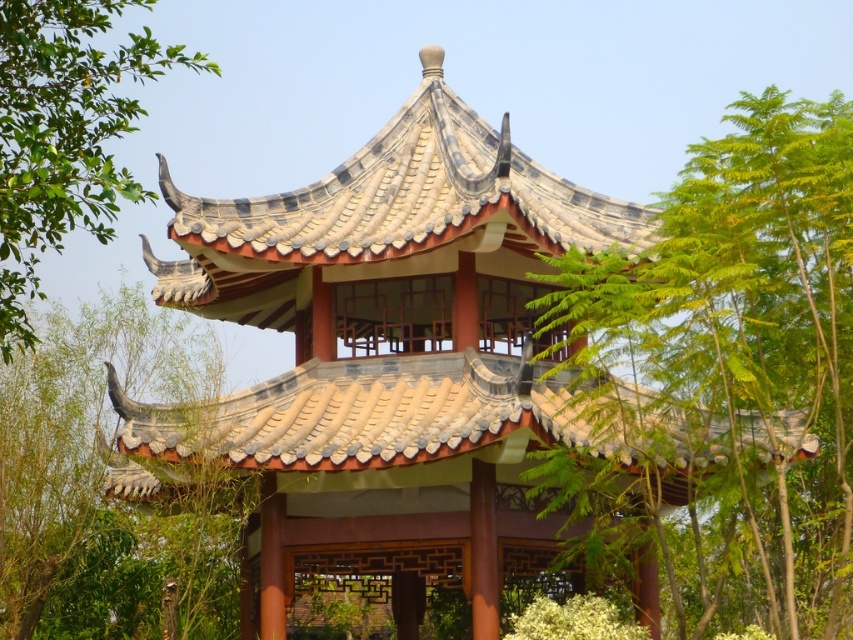
Which of these two, green leafy tree at center or green leafy tree at upper left, stands taller?

With more height is green leafy tree at upper left.

Is green leafy tree at center to the right of green leafy tree at upper left from the viewer's perspective?

Indeed, green leafy tree at center is positioned on the right side of green leafy tree at upper left.

Which is behind, point (787, 326) or point (97, 182)?

Positioned behind is point (787, 326).

This screenshot has height=640, width=853. I want to click on green leafy tree at center, so click(723, 378).

Is brown textured roof at upper center positioned in front of green leafy tree at upper left?

No, brown textured roof at upper center is further to the viewer.

Is brown textured roof at upper center to the left of green leafy tree at upper left from the viewer's perspective?

Incorrect, brown textured roof at upper center is not on the left side of green leafy tree at upper left.

Is point (228, 612) positioned in front of point (73, 22)?

No, it is not.

You are a GUI agent. You are given a task and a screenshot of the screen. Output one action in this format:
    pyautogui.click(x=<x>, y=<y>)
    Task: Click on the brown textured roof at upper center
    The image size is (853, 640).
    Given the screenshot: What is the action you would take?
    pyautogui.click(x=103, y=481)

Does green leafy tree at center appear on the right side of brown textured roof at upper center?

Indeed, green leafy tree at center is positioned on the right side of brown textured roof at upper center.

Which is above, green leafy tree at center or brown textured roof at upper center?

brown textured roof at upper center

Is point (782, 433) farther from camera compared to point (234, 540)?

No, (782, 433) is closer to viewer.

I want to click on green leafy tree at center, so click(x=723, y=378).